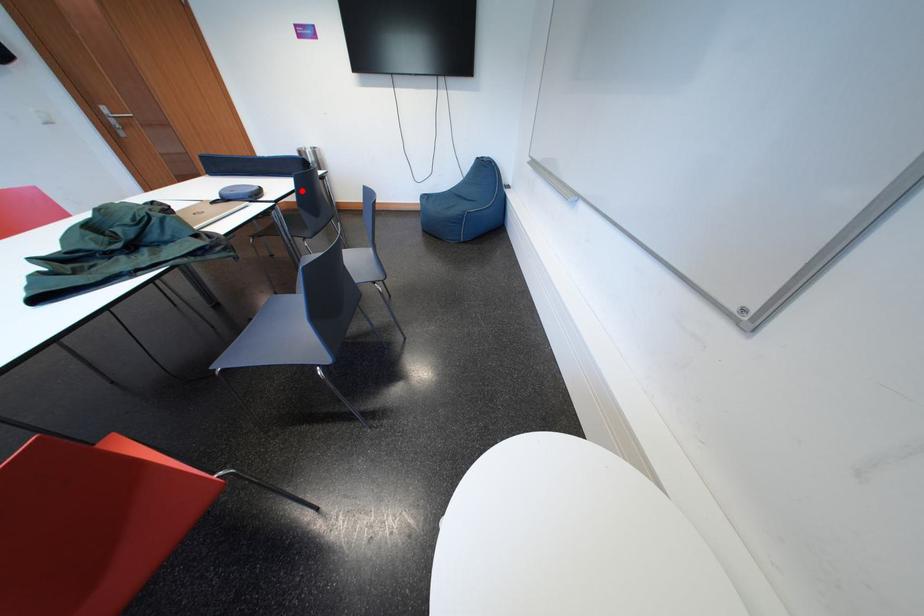
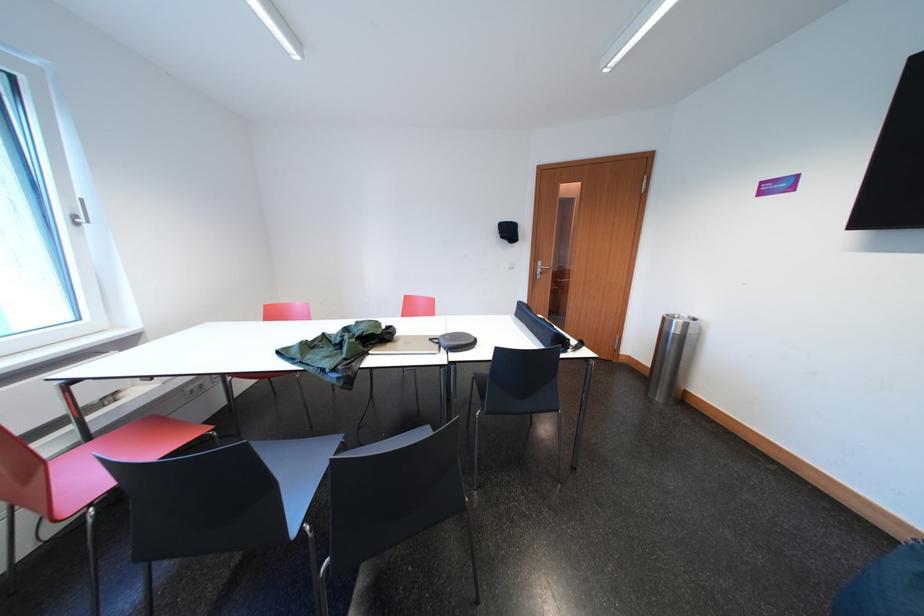
Find the pixel in the second image that matches the highlighted location in the first image.

(499, 361)